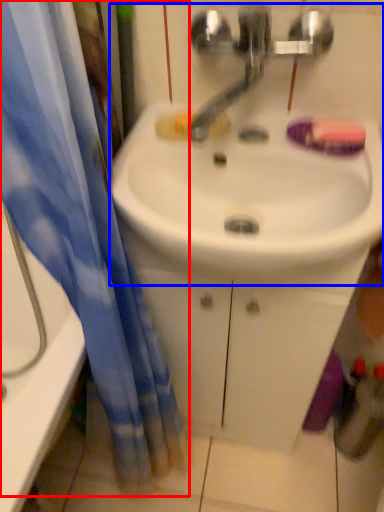
Question: Which object is closer to the camera taking this photo, curtain (highlighted by a red box) or sink (highlighted by a blue box)?

Choices:
 (A) curtain
 (B) sink

Answer: (A)